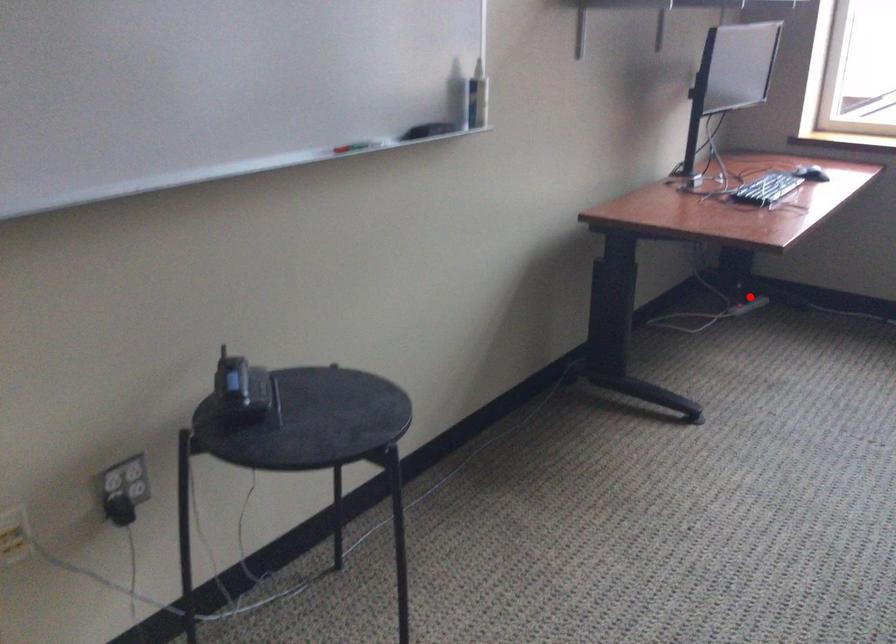
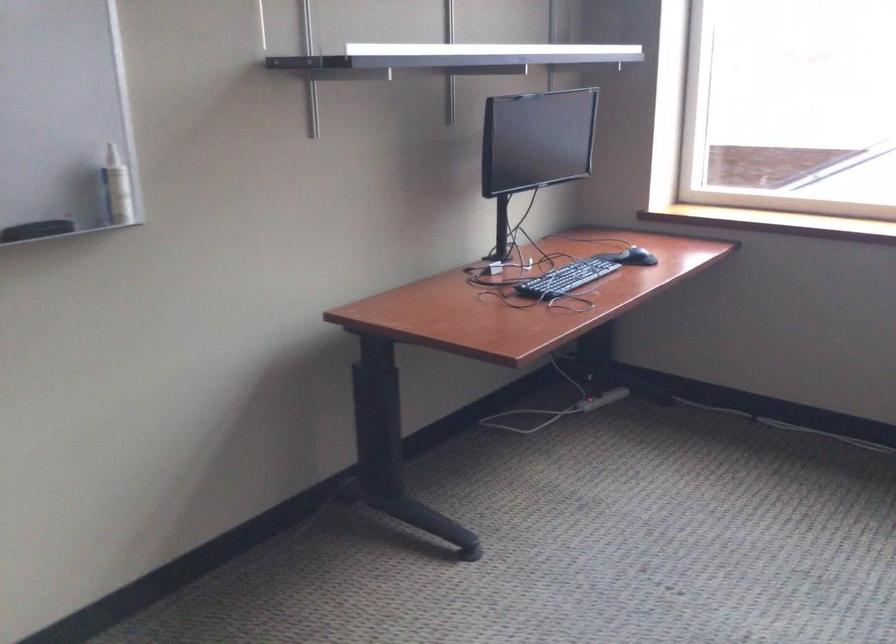
Question: I am providing you with two images of the same scene from different viewpoints. Given a red point in image1, look at the same physical point in image2. Is it:

Choices:
 (A) Closer to the viewpoint
 (B) Farther from the viewpoint

Answer: (A)